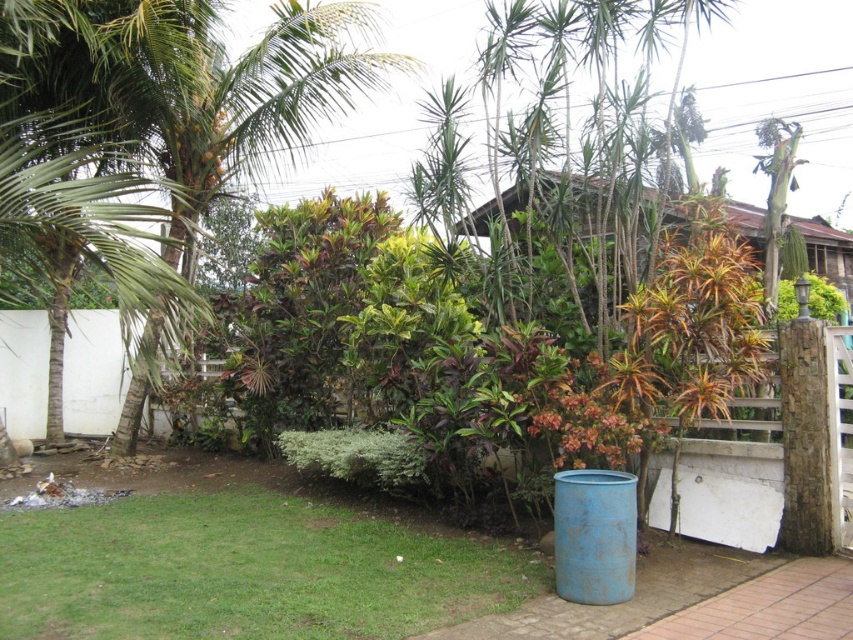
You are standing in the tropical garden and want to place a small statue on the ground near the green grass at lower left. Can you place it directly under the green leafy palm tree at left without it being blocked by the tree?

The green leafy palm tree at left is located above the green grass at lower left, so placing the statue directly under the tree would place it beneath the tree, but since the tree is above the grass, the statue would not be blocked by the tree itself. However, the statue might be shaded by the tree canopy, but physically unobstructed.

You are a visitor in the tropical garden and want to take a photo of both the green leafy palm tree at left and the brown wooden hut at upper center. Which direction should you face to have both objects in your camera frame?

You should face towards the right side of the green leafy palm tree at left so that both the green leafy palm tree at left and the brown wooden hut at upper center are visible in your frame since the green leafy palm tree at left is positioned to the left of the brown wooden hut at upper center.